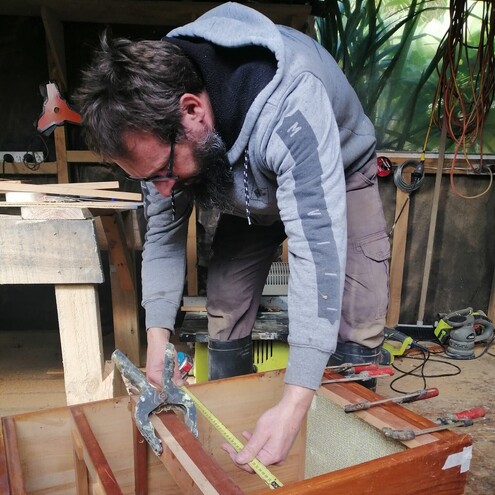
The image size is (495, 495). What are the coordinates of `wooden box inside` in the screenshot? It's located at (232, 409).